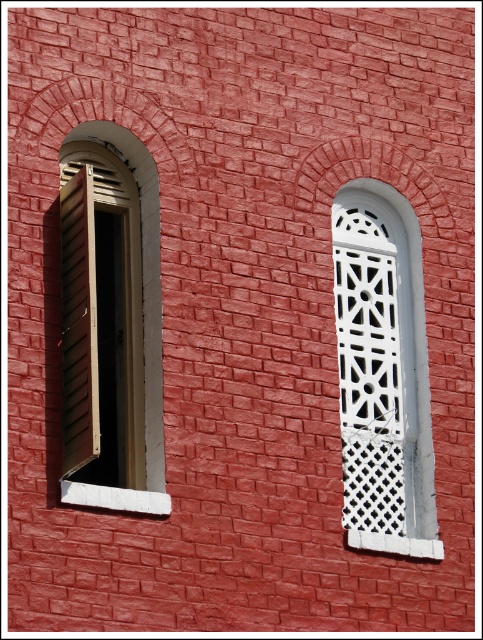
Consider the image. Does white lattice at center have a larger size compared to wooden slats at left?

Incorrect, white lattice at center is not larger than wooden slats at left.

Does white lattice at center have a smaller size compared to wooden slats at left?

Indeed, white lattice at center has a smaller size compared to wooden slats at left.

Find the location of a particular element. Image resolution: width=483 pixels, height=640 pixels. white lattice at center is located at coordinates (383, 372).